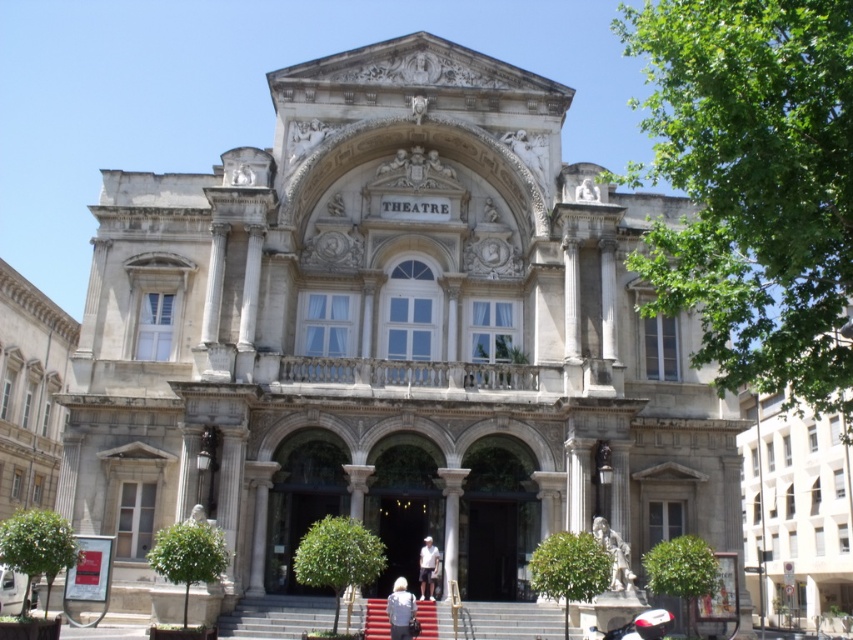
You are standing in front of the grand classical building labeled THEATRE. You notice a white marble pillar at center. Can you determine its exact location using the coordinate system provided?

Answer: The white marble pillar at center is located at point coordinates (x=451, y=522).

You are an event planner setting up for a formal evening at the theatre. You need to place a podium in front of the white marble statue at lower right and the white cotton shirt at center. Which object should you place the podium closer to so that it is proportionate to their sizes?

The podium should be placed closer to the white marble statue at lower right since it has a lesser height compared to the white cotton shirt at center, ensuring the podium is proportionate to their sizes.

You are standing in front of the classical building labeled THEATRE. You notice two points marked on the facade. The first point is at coordinates point (x=462, y=628) and the second is at point (x=416, y=499). Which point do you think is closer to you?

Point (x=462, y=628) is closer to the camera than point (x=416, y=499), so the first point is closer to you.